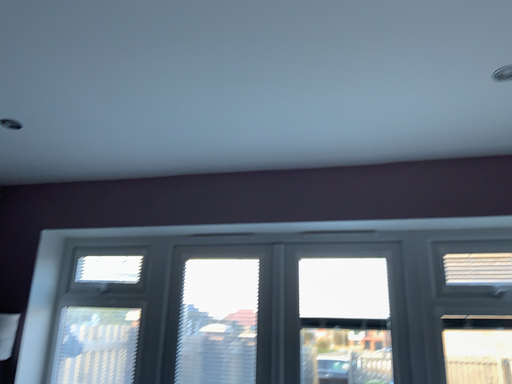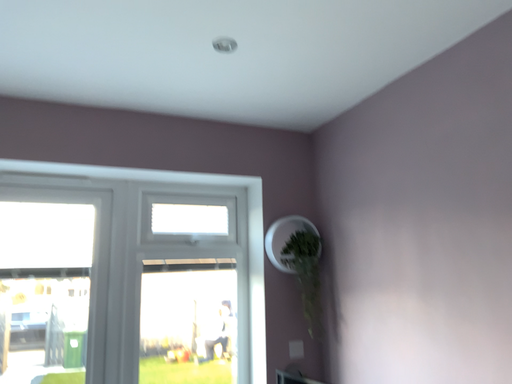
Question: Which way did the camera rotate in the video?

Choices:
 (A) rotated left
 (B) rotated right

Answer: (B)